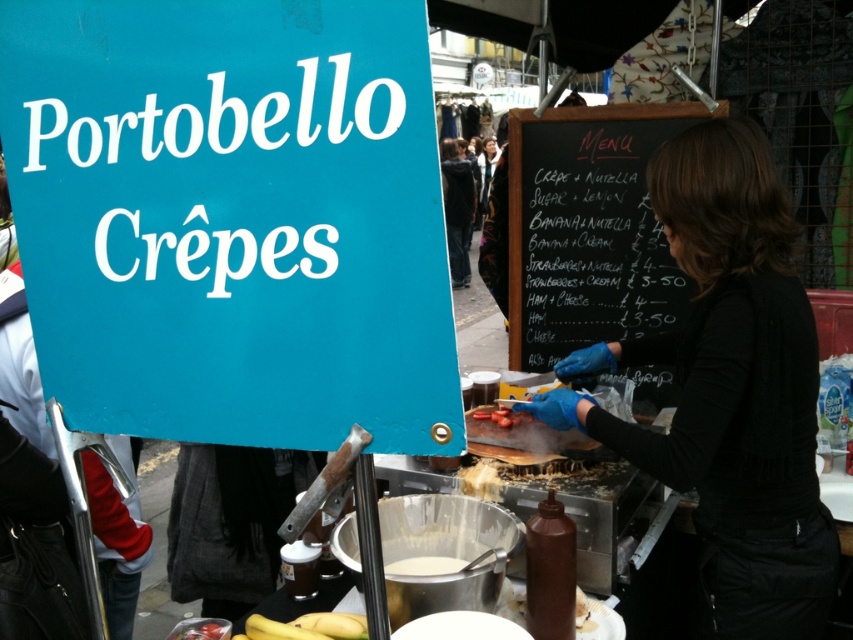
Locate an element on the screen. This screenshot has height=640, width=853. black fabric at center is located at coordinates (729, 388).

Is black fabric at center thinner than black chalkboard menu at center?

Yes, black fabric at center is thinner than black chalkboard menu at center.

Who is more distant from viewer, (724, 221) or (556, 292)?

The point (556, 292) is more distant.

Where is `black fabric at center`? black fabric at center is located at coordinates (729, 388).

How distant is black chalkboard menu at center from smooth tomato at center?

A distance of 31.80 inches exists between black chalkboard menu at center and smooth tomato at center.

Can you confirm if black chalkboard menu at center is positioned to the left of smooth tomato at center?

Incorrect, black chalkboard menu at center is not on the left side of smooth tomato at center.

Locate an element on the screen. black chalkboard menu at center is located at coordinates (589, 228).

What are the coordinates of `black chalkboard menu at center` in the screenshot? It's located at (589, 228).

Based on the photo, who is shorter, black fabric at center or white matte batter at center?

Standing shorter between the two is white matte batter at center.

Find the location of `black fabric at center`. black fabric at center is located at coordinates (729, 388).